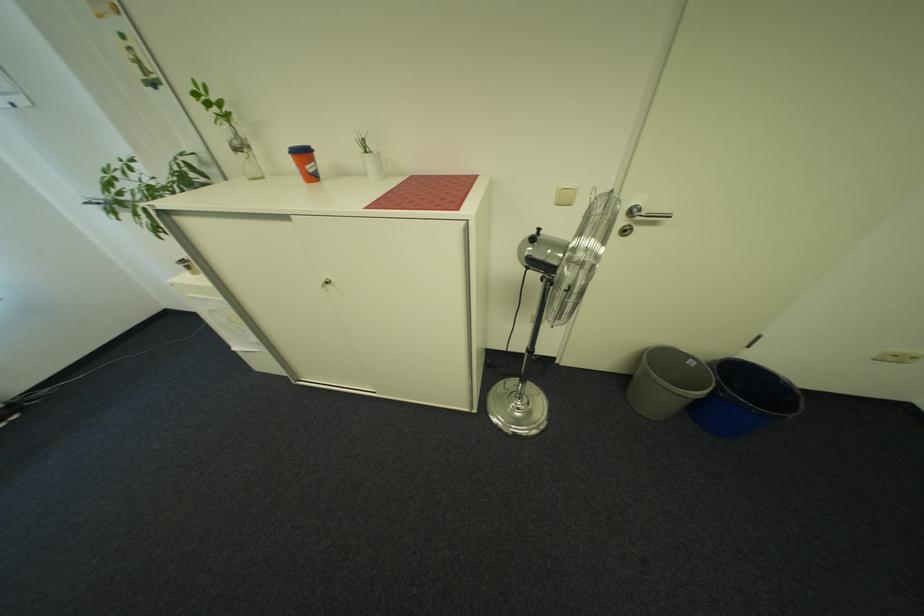
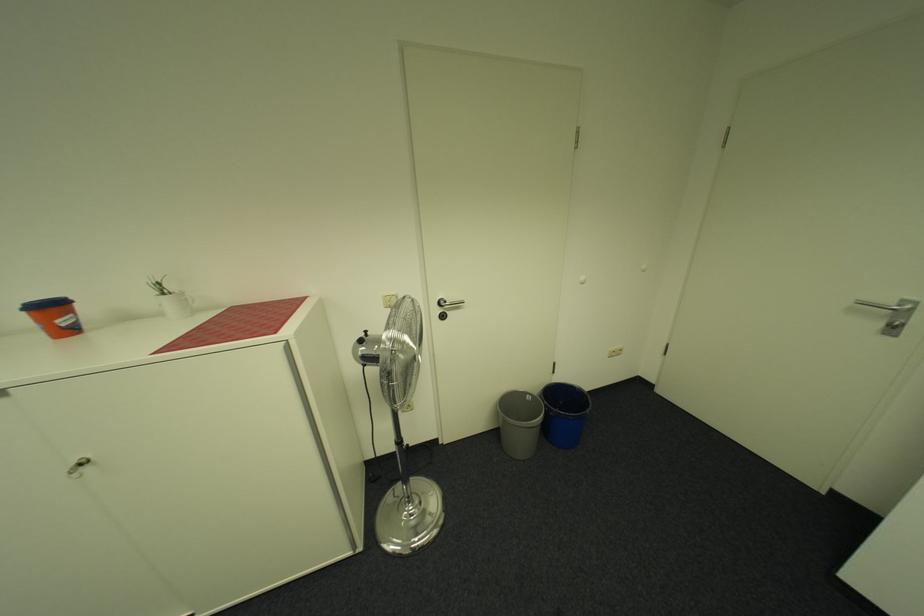
In the second image, find the point that corresponds to (375,153) in the first image.

(173, 294)